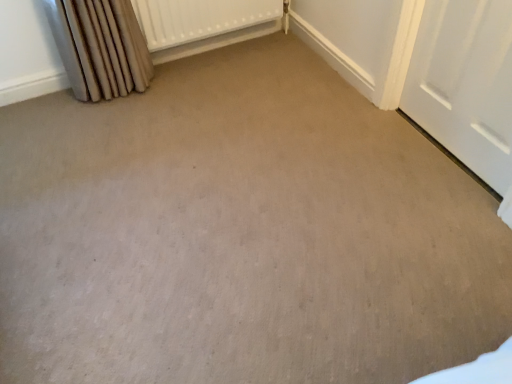
This screenshot has width=512, height=384. Identify the location of white textured radiator at upper center. (199, 19).

What do you see at coordinates (199, 19) in the screenshot?
I see `white textured radiator at upper center` at bounding box center [199, 19].

What is the approximate height of white matte door at right?

white matte door at right is 68.45 centimeters in height.

Find the location of a particular element. white textured radiator at upper center is located at coordinates (199, 19).

Looking at the image, does white textured radiator at upper center seem bigger or smaller compared to white matte door at right?

white textured radiator at upper center is bigger than white matte door at right.

From a real-world perspective, which object rests below the other?

A: white textured radiator at upper center is physically lower.

Is white textured radiator at upper center positioned in front of white matte door at right?

No, it is behind white matte door at right.

From the image's perspective, who appears lower, white textured radiator at upper center or white matte door at right?

white matte door at right appears lower in the image.

Does beige fabric curtain at left have a smaller size compared to white textured radiator at upper center?

Incorrect, beige fabric curtain at left is not smaller in size than white textured radiator at upper center.

Where is `curtain that appears on the left of white textured radiator at upper center`? This screenshot has width=512, height=384. curtain that appears on the left of white textured radiator at upper center is located at coordinates (100, 47).

Does beige fabric curtain at left have a greater width compared to white textured radiator at upper center?

Indeed, beige fabric curtain at left has a greater width compared to white textured radiator at upper center.

From a real-world perspective, who is located higher, beige fabric curtain at left or white textured radiator at upper center?

beige fabric curtain at left is physically above.

Does beige fabric curtain at left have a larger size compared to white matte door at right?

Indeed, beige fabric curtain at left has a larger size compared to white matte door at right.

Would you say beige fabric curtain at left is outside white matte door at right?

Yes, beige fabric curtain at left is outside of white matte door at right.

Which is farther from the camera, (x=61, y=7) or (x=428, y=96)?

Point (x=428, y=96)

From a real-world perspective, between beige fabric curtain at left and white matte door at right, who is vertically lower?

In real-world perspective, beige fabric curtain at left is lower.

Which of these two, white textured radiator at upper center or beige fabric curtain at left, is wider?

With larger width is beige fabric curtain at left.

From a real-world perspective, who is located lower, white textured radiator at upper center or beige fabric curtain at left?

white textured radiator at upper center.

Does white textured radiator at upper center turn towards beige fabric curtain at left?

No, white textured radiator at upper center is not turned towards beige fabric curtain at left.

How many degrees apart are the facing directions of white textured radiator at upper center and beige fabric curtain at left?

The facing directions of white textured radiator at upper center and beige fabric curtain at left are 3.16 degrees apart.

Which is more to the right, white matte door at right or white textured radiator at upper center?

From the viewer's perspective, white matte door at right appears more on the right side.

Which is farther, (412, 68) or (227, 16)?

The point (227, 16) is more distant.

From the image's perspective, between white matte door at right and white textured radiator at upper center, which one is located above?

white textured radiator at upper center, from the image's perspective.

Considering the sizes of objects white matte door at right and beige fabric curtain at left in the image provided, who is thinner, white matte door at right or beige fabric curtain at left?

white matte door at right is thinner.

Considering the sizes of white matte door at right and beige fabric curtain at left in the image, is white matte door at right bigger or smaller than beige fabric curtain at left?

Clearly, white matte door at right is smaller in size than beige fabric curtain at left.

Is there a large distance between white matte door at right and beige fabric curtain at left?

Yes.

From a real-world perspective, does white matte door at right sit lower than beige fabric curtain at left?

No.

You are a GUI agent. You are given a task and a screenshot of the screen. Output one action in this format:
    pyautogui.click(x=<x>, y=<y>)
    Task: Click on the door in front of the white textured radiator at upper center
    
    Given the screenshot: What is the action you would take?
    pyautogui.click(x=465, y=83)

Where is `radiator on the right of the beige fabric curtain at left`? The image size is (512, 384). radiator on the right of the beige fabric curtain at left is located at coordinates (199, 19).

Considering their positions, is white textured radiator at upper center positioned closer to beige fabric curtain at left than white matte door at right?

Based on the image, white textured radiator at upper center appears to be nearer to beige fabric curtain at left.

From the image, which object appears to be farther from white matte door at right, white textured radiator at upper center or beige fabric curtain at left?

beige fabric curtain at left.

Based on their spatial positions, is white matte door at right or white textured radiator at upper center further from beige fabric curtain at left?

Among the two, white matte door at right is located further to beige fabric curtain at left.

Looking at the image, which one is located closer to white matte door at right, beige fabric curtain at left or white textured radiator at upper center?

Among the two, white textured radiator at upper center is located nearer to white matte door at right.

Estimate the real-world distances between objects in this image. Which object is further from white textured radiator at upper center, beige fabric curtain at left or white matte door at right?

The object further to white textured radiator at upper center is white matte door at right.

Based on their spatial positions, is white matte door at right or beige fabric curtain at left further from white textured radiator at upper center?

The object further to white textured radiator at upper center is white matte door at right.

You are a GUI agent. You are given a task and a screenshot of the screen. Output one action in this format:
    pyautogui.click(x=<x>, y=<y>)
    Task: Click on the radiator between beige fabric curtain at left and white matte door at right from left to right
    The height and width of the screenshot is (384, 512).
    Given the screenshot: What is the action you would take?
    pyautogui.click(x=199, y=19)